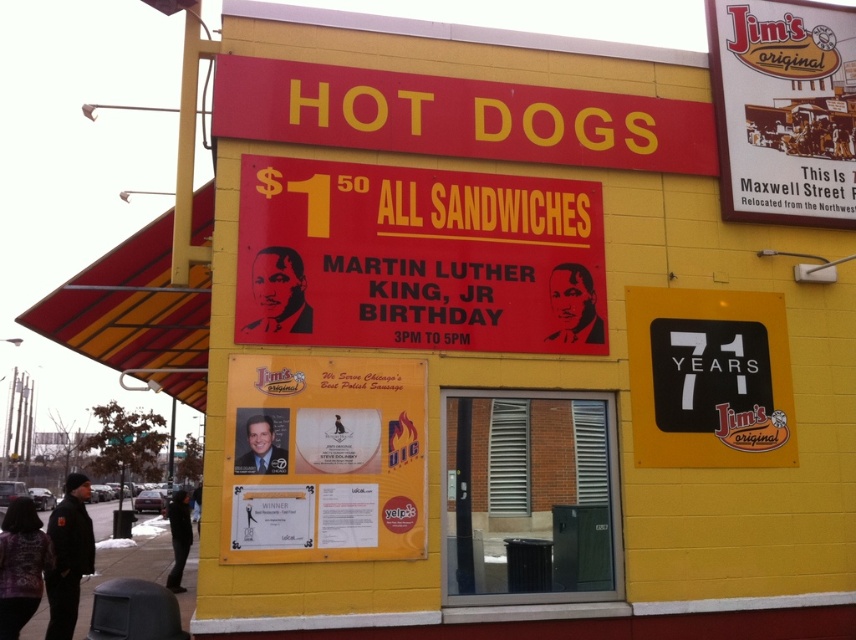
Question: Can you confirm if red matte signboard at center is positioned to the left of matte white sign at upper right?

Choices:
 (A) no
 (B) yes

Answer: (B)

Question: Estimate the real-world distances between objects in this image. Which object is farther from the red matte signboard at center?

Choices:
 (A) black plastic sign at right
 (B) matte white sign at upper right

Answer: (B)

Question: Estimate the real-world distances between objects in this image. Which object is farther from the matte white sign at upper right?

Choices:
 (A) black plastic sign at right
 (B) matte yellow signboard at center

Answer: (B)

Question: Can you confirm if matte yellow signboard at center is bigger than black plastic sign at right?

Choices:
 (A) no
 (B) yes

Answer: (A)

Question: Does matte yellow signboard at center have a lesser width compared to matte white sign at upper right?

Choices:
 (A) no
 (B) yes

Answer: (B)

Question: Which of these objects is positioned farthest from the matte white sign at upper right?

Choices:
 (A) red matte signboard at center
 (B) matte yellow signboard at center
 (C) black plastic sign at right

Answer: (B)